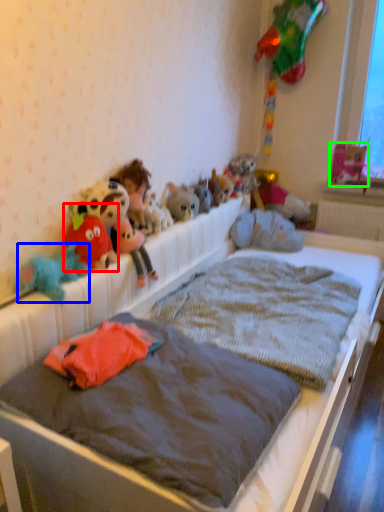
Question: Considering the real-world distances, which object is closest to toy (highlighted by a red box)? toy (highlighted by a blue box) or toy (highlighted by a green box).

Choices:
 (A) toy
 (B) toy

Answer: (A)